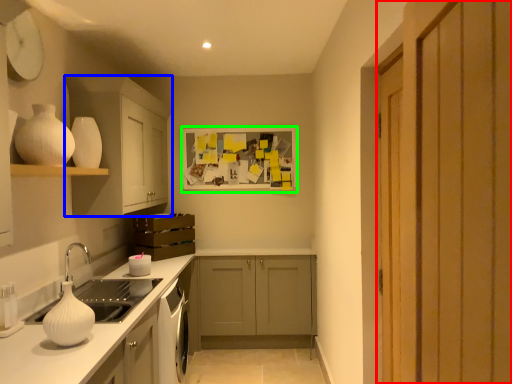
Question: Estimate the real-world distances between objects in this image. Which object is closer to door (highlighted by a red box), cabinetry (highlighted by a blue box) or picture frame (highlighted by a green box)?

Choices:
 (A) cabinetry
 (B) picture frame

Answer: (A)